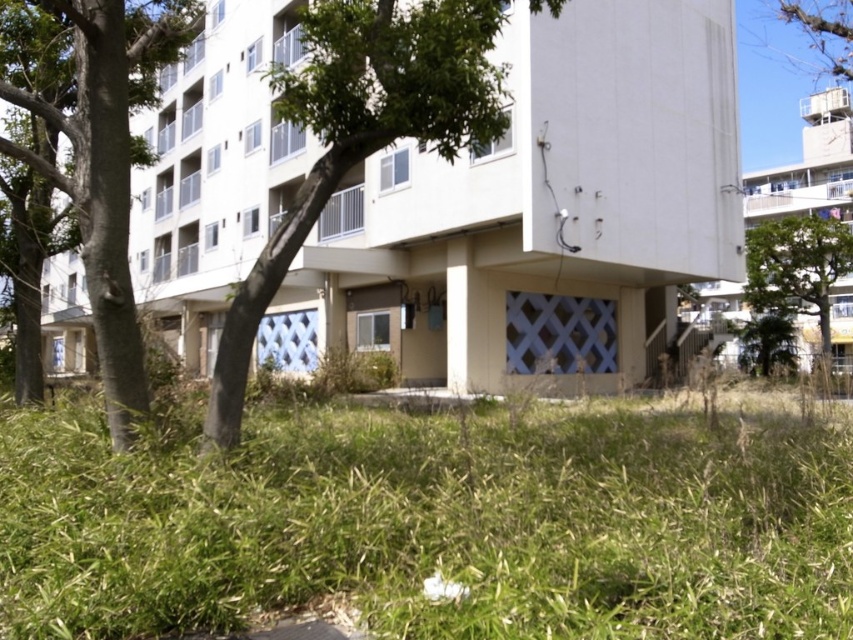
Does green leafy tree at center have a lesser height compared to green leafy tree at upper right?

Yes, green leafy tree at center is shorter than green leafy tree at upper right.

Is point (413, 96) closer to viewer compared to point (817, 304)?

Yes.

Identify the location of green leafy tree at center. (361, 132).

This screenshot has width=853, height=640. What do you see at coordinates (434, 524) in the screenshot? I see `green grass at lower center` at bounding box center [434, 524].

Which of these two, green grass at lower center or green leafy tree at upper right, stands shorter?

green grass at lower center

Which is in front, point (734, 595) or point (749, 269)?

Point (734, 595) is more forward.

The height and width of the screenshot is (640, 853). I want to click on green grass at lower center, so click(434, 524).

Between green grass at lower center and green leafy tree at center, which one is positioned higher?

Positioned higher is green leafy tree at center.

Who is taller, green grass at lower center or green leafy tree at center?

With more height is green leafy tree at center.

Between point (529, 616) and point (366, 4), which one is positioned behind?

Positioned behind is point (366, 4).

The height and width of the screenshot is (640, 853). I want to click on green grass at lower center, so click(x=434, y=524).